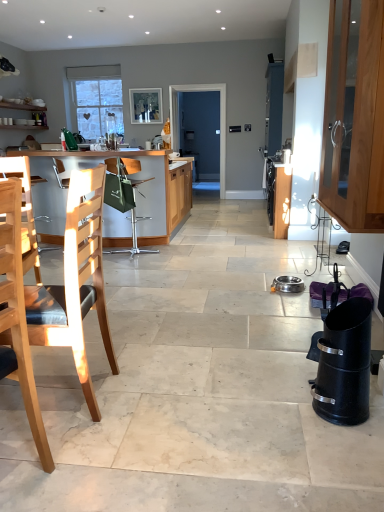
At what (x,y) coordinates should I click in order to perform the action: click on vacant area that lies between light wood chair at left, the 3th chair positioned from the back, and black matte trash can at lower right, which is the first appliance from front to back. Please return your answer as a coordinate pair (x, y). The width and height of the screenshot is (384, 512). Looking at the image, I should click on (187, 444).